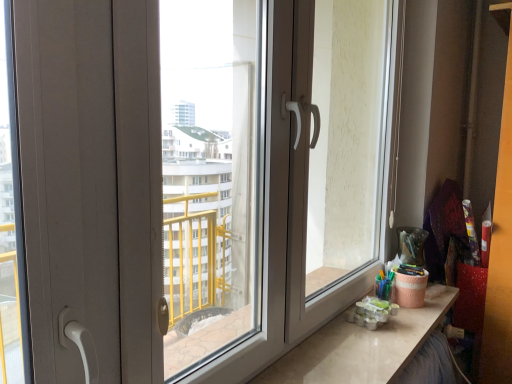
Question: Is the depth of transparent plastic window screen at center greater than that of matte white counter top at lower right?

Choices:
 (A) yes
 (B) no

Answer: (B)

Question: Is transparent plastic window screen at center to the left of matte white counter top at lower right from the viewer's perspective?

Choices:
 (A) no
 (B) yes

Answer: (B)

Question: Would you consider transparent plastic window screen at center to be distant from matte white counter top at lower right?

Choices:
 (A) no
 (B) yes

Answer: (A)

Question: Does transparent plastic window screen at center lie in front of matte white counter top at lower right?

Choices:
 (A) yes
 (B) no

Answer: (A)

Question: Is matte white counter top at lower right at the back of transparent plastic window screen at center?

Choices:
 (A) yes
 (B) no

Answer: (B)

Question: Considering the relative positions of transparent plastic window screen at center and matte white counter top at lower right in the image provided, is transparent plastic window screen at center to the right of matte white counter top at lower right from the viewer's perspective?

Choices:
 (A) no
 (B) yes

Answer: (A)

Question: Is transparent plastic window screen at center oriented towards matte white screen door at right?

Choices:
 (A) yes
 (B) no

Answer: (B)

Question: Does transparent plastic window screen at center come behind matte white screen door at right?

Choices:
 (A) yes
 (B) no

Answer: (B)

Question: Can you confirm if transparent plastic window screen at center is positioned to the left of matte white screen door at right?

Choices:
 (A) no
 (B) yes

Answer: (B)

Question: Considering the relative sizes of transparent plastic window screen at center and matte white screen door at right in the image provided, is transparent plastic window screen at center taller than matte white screen door at right?

Choices:
 (A) yes
 (B) no

Answer: (B)

Question: From the image's perspective, is transparent plastic window screen at center below matte white screen door at right?

Choices:
 (A) no
 (B) yes

Answer: (B)

Question: Can you confirm if transparent plastic window screen at center is positioned to the right of matte white screen door at right?

Choices:
 (A) yes
 (B) no

Answer: (B)

Question: Can you confirm if matte white screen door at right is positioned to the left of matte white counter top at lower right?

Choices:
 (A) yes
 (B) no

Answer: (A)